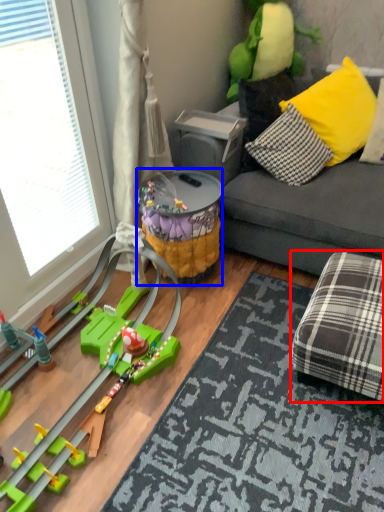
Question: Which object is closer to the camera taking this photo, stool (highlighted by a red box) or toy (highlighted by a blue box)?

Choices:
 (A) stool
 (B) toy

Answer: (A)